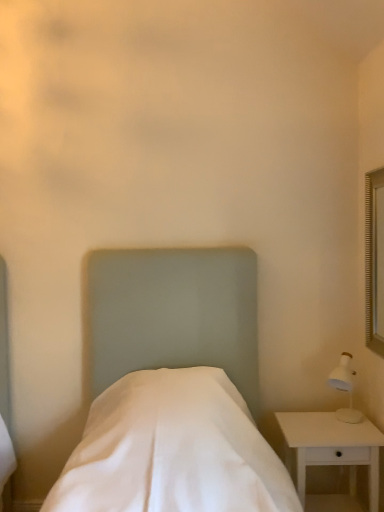
Question: Should I look upward or downward to see white wood nightstand at lower right?

Choices:
 (A) down
 (B) up

Answer: (A)

Question: From a real-world perspective, is white wood nightstand at lower right physically below white fabric bed at center?

Choices:
 (A) yes
 (B) no

Answer: (A)

Question: Is white wood nightstand at lower right not inside white fabric bed at center?

Choices:
 (A) no
 (B) yes

Answer: (A)

Question: Is white wood nightstand at lower right smaller than white fabric bed at center?

Choices:
 (A) no
 (B) yes

Answer: (B)

Question: Considering the relative positions of white wood nightstand at lower right and white fabric bed at center in the image provided, is white wood nightstand at lower right behind white fabric bed at center?

Choices:
 (A) yes
 (B) no

Answer: (A)

Question: Considering the relative sizes of white wood nightstand at lower right and white fabric bed at center in the image provided, is white wood nightstand at lower right thinner than white fabric bed at center?

Choices:
 (A) no
 (B) yes

Answer: (B)

Question: From the image's perspective, does white wood nightstand at lower right appear lower than white fabric bed at center?

Choices:
 (A) no
 (B) yes

Answer: (B)

Question: From the image's perspective, would you say white fabric bed at center is shown under white wood nightstand at lower right?

Choices:
 (A) yes
 (B) no

Answer: (B)

Question: Considering the relative sizes of white fabric bed at center and white wood nightstand at lower right in the image provided, is white fabric bed at center thinner than white wood nightstand at lower right?

Choices:
 (A) no
 (B) yes

Answer: (A)

Question: Does white fabric bed at center come behind white wood nightstand at lower right?

Choices:
 (A) no
 (B) yes

Answer: (A)

Question: Considering the relative positions of white fabric bed at center and white wood nightstand at lower right in the image provided, is white fabric bed at center in front of white wood nightstand at lower right?

Choices:
 (A) yes
 (B) no

Answer: (A)

Question: Is white fabric bed at center wider than white wood nightstand at lower right?

Choices:
 (A) no
 (B) yes

Answer: (B)

Question: Is white fabric bed at center turned away from white wood nightstand at lower right?

Choices:
 (A) no
 (B) yes

Answer: (A)

Question: Choose the correct answer: Is white wood nightstand at lower right inside white fabric bed at center or outside it?

Choices:
 (A) outside
 (B) inside

Answer: (A)